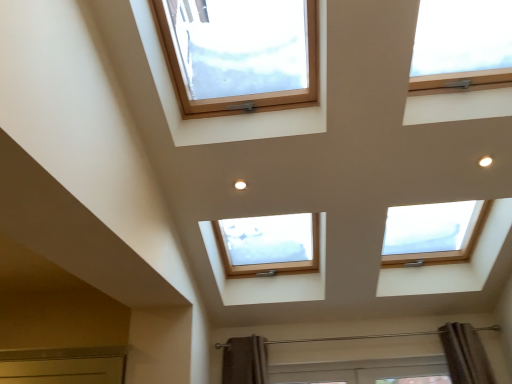
Question: Can you confirm if clear glass window at upper left, the first window from the left, is wider than natural wood window at upper right, which appears as the 2th window when viewed from the left?

Choices:
 (A) yes
 (B) no

Answer: (A)

Question: From a real-world perspective, does clear glass window at upper left, the first window from the left, stand above natural wood window at upper right, the first window in the right-to-left sequence?

Choices:
 (A) no
 (B) yes

Answer: (B)

Question: Is clear glass window at upper left, the 2th window when ordered from right to left, completely or partially outside of natural wood window at upper right, which appears as the 2th window when viewed from the left?

Choices:
 (A) yes
 (B) no

Answer: (A)

Question: Considering the relative positions of clear glass window at upper left, the first window from the left, and natural wood window at upper right, which appears as the 2th window when viewed from the left, in the image provided, is clear glass window at upper left, the first window from the left, in front of natural wood window at upper right, which appears as the 2th window when viewed from the left,?

Choices:
 (A) yes
 (B) no

Answer: (A)

Question: Could you tell me if clear glass window at upper left, the 2th window when ordered from right to left, is facing natural wood window at upper right, which appears as the 2th window when viewed from the left?

Choices:
 (A) no
 (B) yes

Answer: (A)

Question: From the image's perspective, would you say clear glass window at upper left, the first window from the left, is positioned over natural wood window at upper right, the first window in the right-to-left sequence?

Choices:
 (A) yes
 (B) no

Answer: (B)

Question: From a real-world perspective, is natural wood window at upper right, the first window in the right-to-left sequence, located beneath clear glass window at upper left, the first window from the left?

Choices:
 (A) no
 (B) yes

Answer: (B)

Question: Is natural wood window at upper right, the first window in the right-to-left sequence, further to camera compared to clear glass window at upper left, the first window from the left?

Choices:
 (A) yes
 (B) no

Answer: (A)

Question: Does natural wood window at upper right, the first window in the right-to-left sequence, have a greater width compared to clear glass window at upper left, the 2th window when ordered from right to left?

Choices:
 (A) no
 (B) yes

Answer: (A)

Question: From the image's perspective, would you say natural wood window at upper right, the first window in the right-to-left sequence, is positioned over clear glass window at upper left, the first window from the left?

Choices:
 (A) no
 (B) yes

Answer: (B)

Question: Considering the relative sizes of natural wood window at upper right, which appears as the 2th window when viewed from the left, and clear glass window at upper left, the first window from the left, in the image provided, is natural wood window at upper right, which appears as the 2th window when viewed from the left, shorter than clear glass window at upper left, the first window from the left,?

Choices:
 (A) yes
 (B) no

Answer: (A)

Question: Is natural wood window at upper right, the first window in the right-to-left sequence, bigger than clear glass window at upper left, the first window from the left?

Choices:
 (A) no
 (B) yes

Answer: (A)

Question: Based on their sizes in the image, would you say clear glass window at upper left, the first window from the left, is bigger or smaller than natural wood window at upper right, which appears as the 2th window when viewed from the left?

Choices:
 (A) small
 (B) big

Answer: (B)